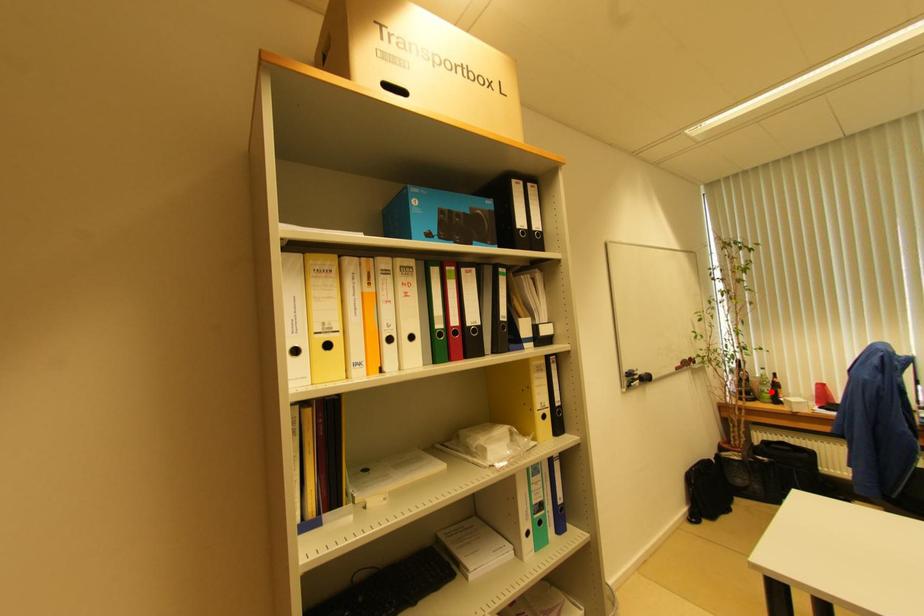
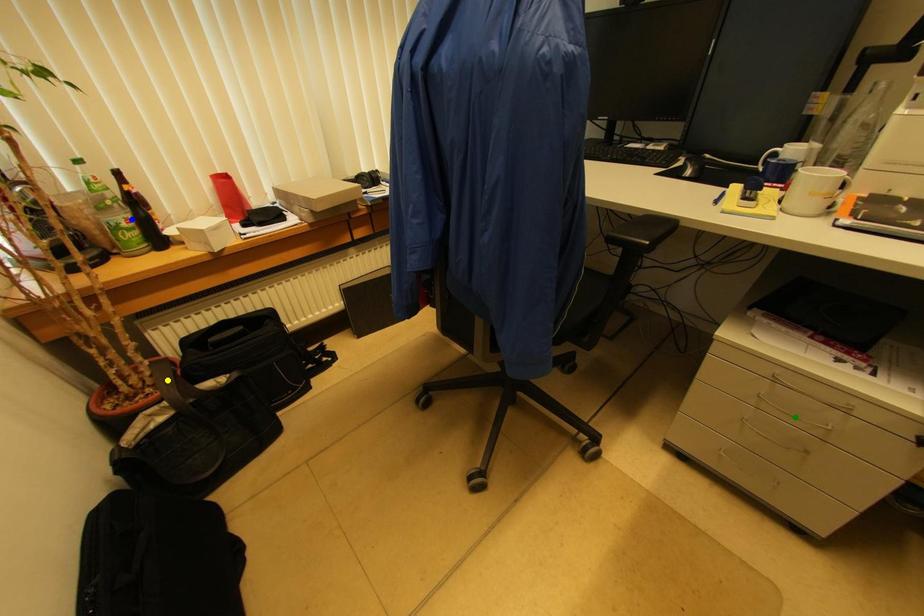
Question: I am providing you with two images of the same scene from different viewpoints. A red point is marked on the first image. You are given multiple points on the second image. Which point in image 2 represents the same 3d spot as the red point in image 1?

Choices:
 (A) green point
 (B) yellow point
 (C) blue point

Answer: (C)